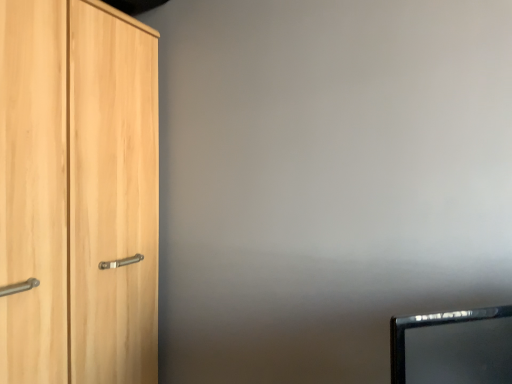
Question: Is light wood cupboard at left spatially inside black glossy monitor at lower right, or outside of it?

Choices:
 (A) outside
 (B) inside

Answer: (A)

Question: Is point (77, 11) closer or farther from the camera than point (500, 365)?

Choices:
 (A) closer
 (B) farther

Answer: (B)

Question: From the image's perspective, is light wood cupboard at left above or below black glossy monitor at lower right?

Choices:
 (A) above
 (B) below

Answer: (A)

Question: Is black glossy monitor at lower right inside the boundaries of light wood cupboard at left, or outside?

Choices:
 (A) outside
 (B) inside

Answer: (A)

Question: Considering the relative positions of black glossy monitor at lower right and light wood cupboard at left in the image provided, is black glossy monitor at lower right to the left or to the right of light wood cupboard at left?

Choices:
 (A) left
 (B) right

Answer: (B)

Question: Is black glossy monitor at lower right bigger or smaller than light wood cupboard at left?

Choices:
 (A) small
 (B) big

Answer: (A)

Question: Considering the positions of point (409, 317) and point (3, 134), is point (409, 317) closer or farther from the camera than point (3, 134)?

Choices:
 (A) farther
 (B) closer

Answer: (A)